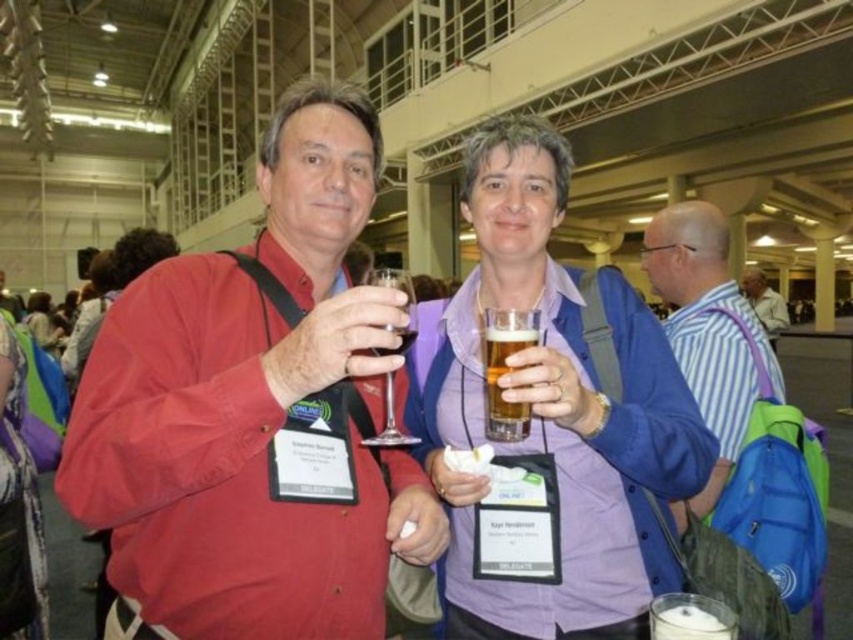
Question: Which of the following is the farthest from the observer?

Choices:
 (A) (387, 381)
 (B) (780, 308)

Answer: (B)

Question: Which is farther from the matte red shirt at center?

Choices:
 (A) golden amber liquid at center
 (B) matte purple shirt at center
 (C) translucent glass wine glass at center
 (D) blue striped shirt at right

Answer: (B)

Question: Can you confirm if purple fabric shirt at center is smaller than matte purple shirt at center?

Choices:
 (A) no
 (B) yes

Answer: (B)

Question: Is purple fabric shirt at center further to the viewer compared to clear glass wine at center?

Choices:
 (A) yes
 (B) no

Answer: (B)

Question: Can you confirm if purple fabric shirt at center is positioned below clear glass wine at center?

Choices:
 (A) no
 (B) yes

Answer: (A)

Question: Which object appears closest to the camera in this image?

Choices:
 (A) striped cotton shirt at center
 (B) clear glass wine at center

Answer: (B)